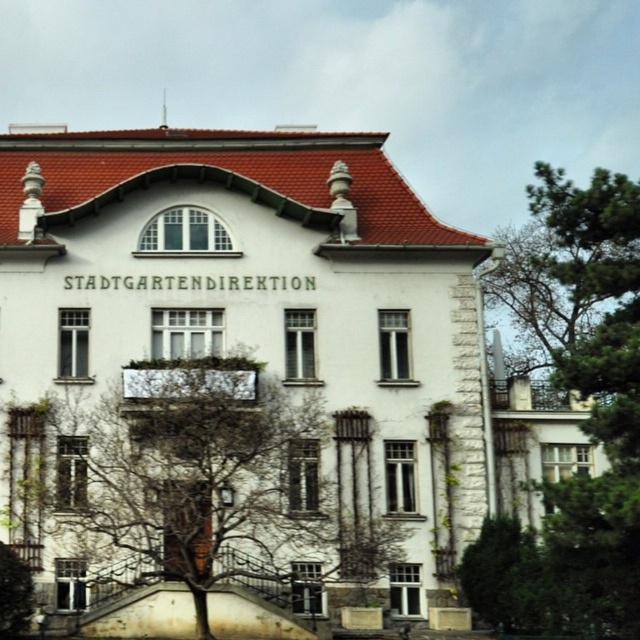
You are standing in front of the two story building and see the bare branches at lower left and the green leafy tree at upper right. Which object is closer to the ground?

The bare branches at lower left is closer to the ground because it is positioned below the green leafy tree at upper right.

You are standing in front of the two story building and want to walk towards the bare branches at lower left and the green leafy tree at upper right. Which object will you reach first?

You will reach the bare branches at lower left first because it is closer to you than the green leafy tree at upper right, which is further away.